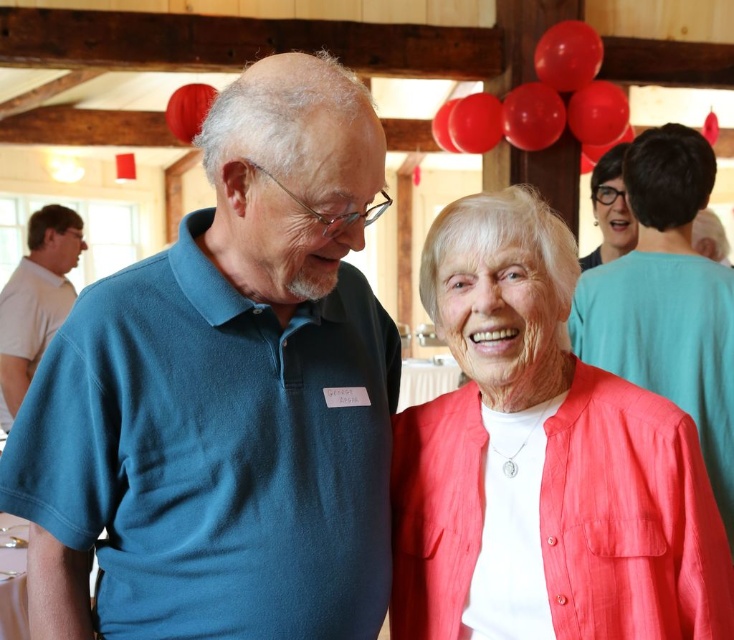
What is the color of the clothing worn by the person at the point with coordinates [34,300]?

The point at coordinates [34,300] corresponds to the white cotton shirt at left.

You are a photographer at the event and need to capture a candid shot of both the blue cotton polo shirt at left and the matte black glasses at upper right in the same frame. Based on their positions, which object should you focus on first to ensure both are in the frame?

The blue cotton polo shirt at left is positioned under matte black glasses at upper right, so you should focus on the matte black glasses at upper right first to ensure both are included in the frame.

What is the 2D coordinate of the white cotton shirt at left in the image?

The 2D coordinate of the white cotton shirt at left is at point (34,300).